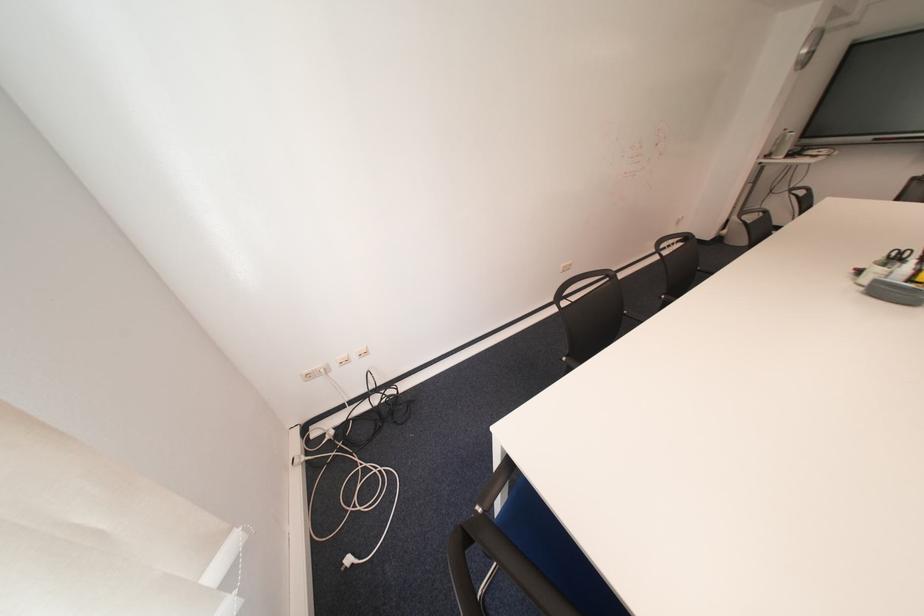
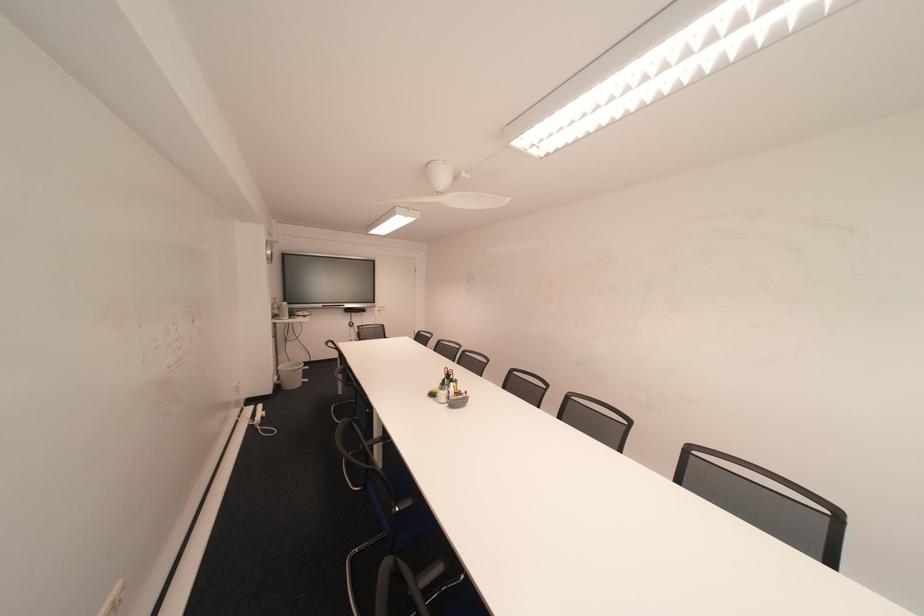
Question: The first image is from the beginning of the video and the second image is from the end. How did the camera likely rotate when shooting the video?

Choices:
 (A) Left
 (B) Right
 (C) Up
 (D) Down

Answer: (B)